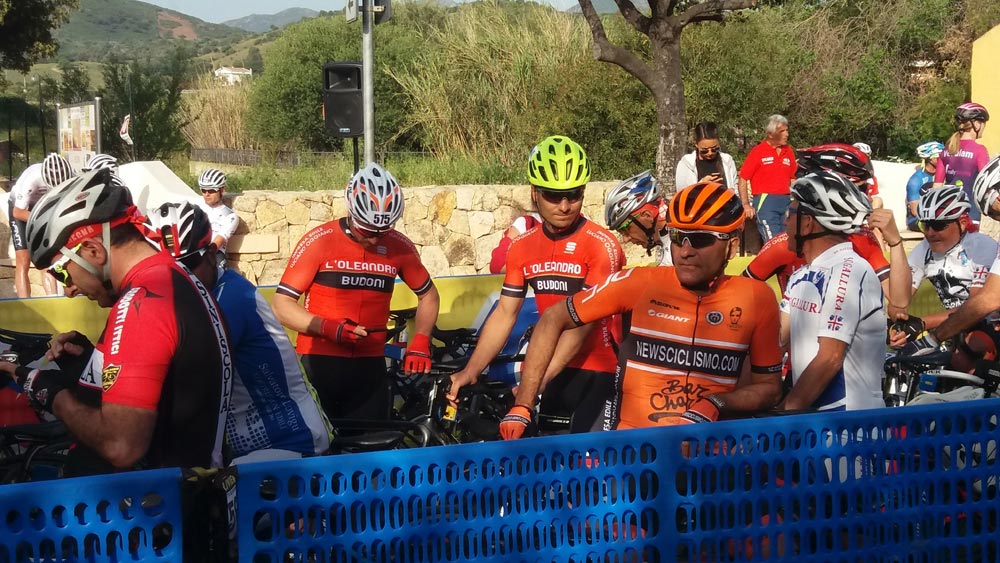
Identify the location of speaker. (322, 108).